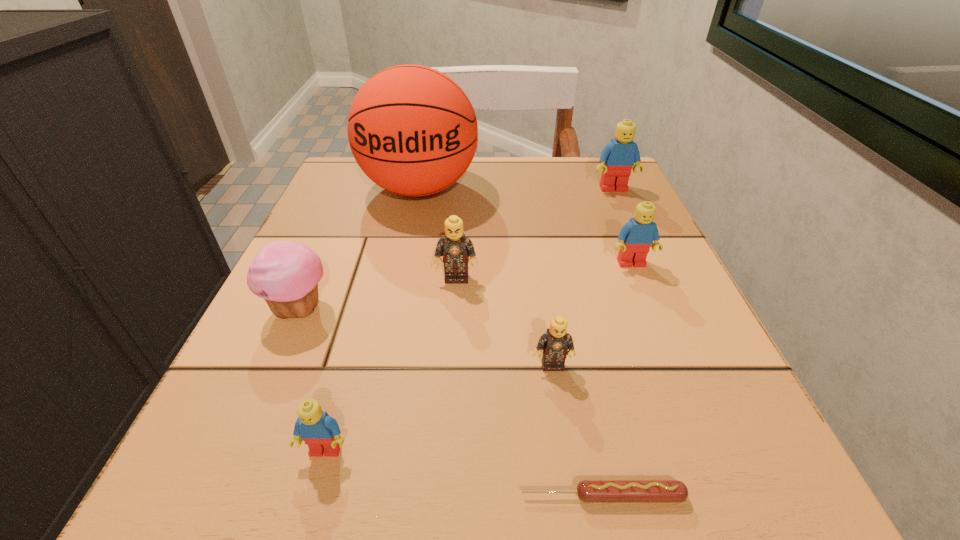
You are a GUI agent. You are given a task and a screenshot of the screen. Output one action in this format:
    pyautogui.click(x=<x>, y=<y>)
    Task: Click on the third Lego from right to left
    
    Given the screenshot: What is the action you would take?
    pyautogui.click(x=556, y=344)

I want to click on the seventh farthest object, so pyautogui.click(x=318, y=430).

Image resolution: width=960 pixels, height=540 pixels. I want to click on the leftmost blue Lego, so click(x=318, y=430).

Image resolution: width=960 pixels, height=540 pixels. I want to click on brown sausage, so click(589, 491).

The width and height of the screenshot is (960, 540). I want to click on sausage, so [589, 491].

Where is `free space located on the side with logo of the tallest object`? free space located on the side with logo of the tallest object is located at coordinates (399, 287).

The width and height of the screenshot is (960, 540). Find the location of `vacant space located on the face of the biggest blue Lego`. vacant space located on the face of the biggest blue Lego is located at coordinates (664, 303).

Find the location of a particular element. The height and width of the screenshot is (540, 960). free point located on the face of the sixth nearest object is located at coordinates (661, 337).

The image size is (960, 540). Find the location of `vacant space situated 0.160m in front of the farther tan Lego`. vacant space situated 0.160m in front of the farther tan Lego is located at coordinates (451, 362).

The width and height of the screenshot is (960, 540). Find the location of `free space located on the right of the cupcake`. free space located on the right of the cupcake is located at coordinates (423, 309).